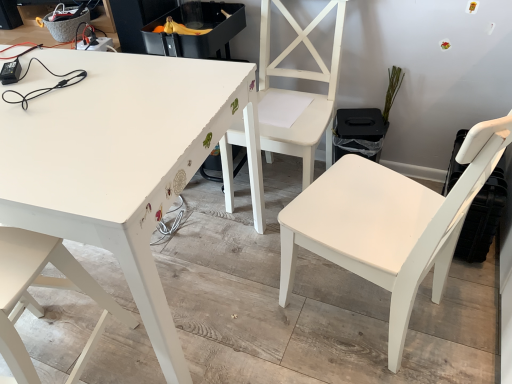
This screenshot has height=384, width=512. In order to click on vacant area situated below white matte chair at center, which is the 2th chair in left-to-right order (from a real-world perspective) in this screenshot , I will do (x=270, y=184).